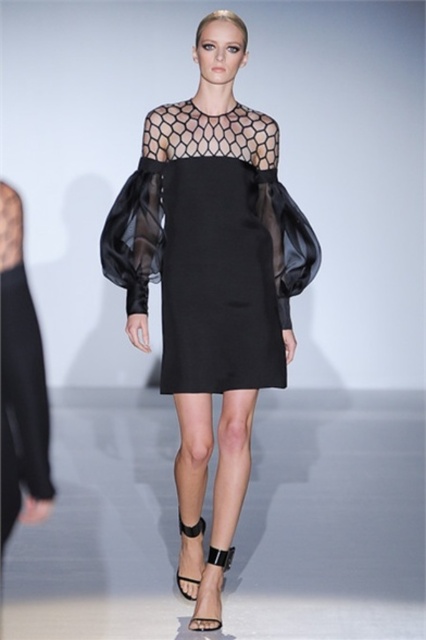
Question: Which object is closer to the camera taking this photo?

Choices:
 (A) black leather sandal at center
 (B) black leather sandal at lower center
 (C) black sheer dress at center

Answer: (C)

Question: Among these objects, which one is nearest to the camera?

Choices:
 (A) black leather sandal at lower center
 (B) black sheer dress at center
 (C) black leather sandal at center

Answer: (B)

Question: Where is black sheer dress at center located in relation to black leather sandal at center in the image?

Choices:
 (A) right
 (B) left

Answer: (A)

Question: Does black sheer dress at center have a smaller size compared to black leather sandal at lower center?

Choices:
 (A) yes
 (B) no

Answer: (B)

Question: Is the position of black sheer dress at center more distant than that of black leather sandal at lower center?

Choices:
 (A) yes
 (B) no

Answer: (B)

Question: Which point is farther from the camera taking this photo?

Choices:
 (A) (270, 145)
 (B) (201, 522)

Answer: (B)